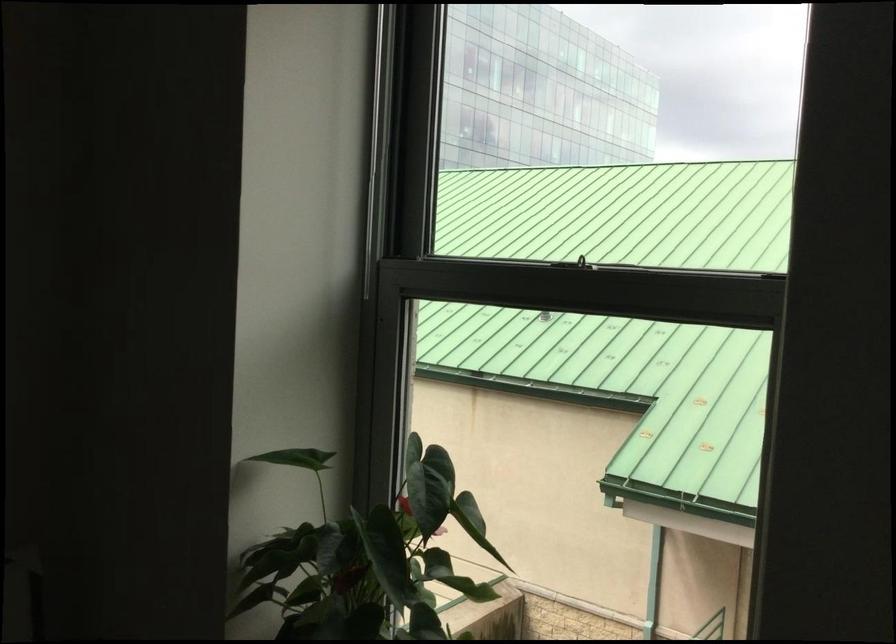
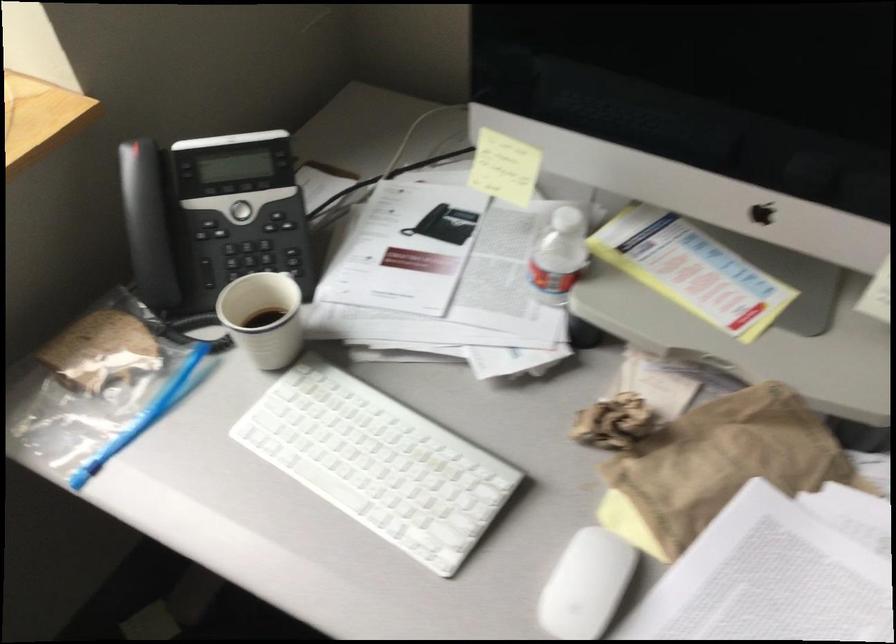
The images are taken continuously from a first-person perspective. In which direction is your viewpoint rotating?

The camera's rotation is toward right-down.